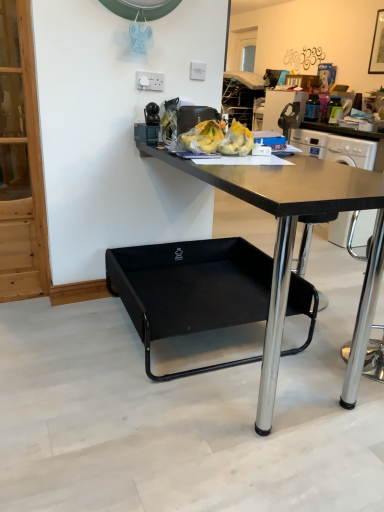
Question: Is black glass picture frame at upper right taller than black matte desk at center?

Choices:
 (A) no
 (B) yes

Answer: (A)

Question: Considering the relative positions of black glass picture frame at upper right and black matte desk at center in the image provided, is black glass picture frame at upper right to the right of black matte desk at center from the viewer's perspective?

Choices:
 (A) yes
 (B) no

Answer: (A)

Question: Does black glass picture frame at upper right have a lesser height compared to black matte desk at center?

Choices:
 (A) no
 (B) yes

Answer: (B)

Question: Is black glass picture frame at upper right turned away from black matte desk at center?

Choices:
 (A) no
 (B) yes

Answer: (A)

Question: Considering the relative sizes of black glass picture frame at upper right and black matte desk at center in the image provided, is black glass picture frame at upper right thinner than black matte desk at center?

Choices:
 (A) no
 (B) yes

Answer: (B)

Question: In terms of size, does black glass picture frame at upper right appear bigger or smaller than white plastic power outlet at upper center, the 2th power outlet when ordered from back to front?

Choices:
 (A) big
 (B) small

Answer: (A)

Question: From the image's perspective, is black glass picture frame at upper right above or below white plastic power outlet at upper center, the 2th power outlet when ordered from back to front?

Choices:
 (A) below
 (B) above

Answer: (B)

Question: Choose the correct answer: Is black glass picture frame at upper right inside white plastic power outlet at upper center, which is counted as the 1th power outlet, starting from the front, or outside it?

Choices:
 (A) outside
 (B) inside

Answer: (A)

Question: In the image, is black glass picture frame at upper right on the left side or the right side of white plastic power outlet at upper center, the 1th power outlet in the left-to-right sequence?

Choices:
 (A) left
 (B) right

Answer: (B)

Question: From a real-world perspective, is black glass picture frame at upper right positioned above or below metallic black coffee machine at upper right?

Choices:
 (A) below
 (B) above

Answer: (B)

Question: From their relative heights in the image, would you say black glass picture frame at upper right is taller or shorter than metallic black coffee machine at upper right?

Choices:
 (A) short
 (B) tall

Answer: (B)

Question: Relative to metallic black coffee machine at upper right, is black glass picture frame at upper right in front or behind?

Choices:
 (A) front
 (B) behind

Answer: (A)

Question: In terms of width, does black glass picture frame at upper right look wider or thinner when compared to metallic black coffee machine at upper right?

Choices:
 (A) thin
 (B) wide

Answer: (A)

Question: Would you say white plastic power outlet at upper center, the 2th power outlet in the front-to-back sequence, is to the left or to the right of white plastic power outlet at upper center, the 1th power outlet in the left-to-right sequence, in the picture?

Choices:
 (A) right
 (B) left

Answer: (A)

Question: Considering the positions of white plastic power outlet at upper center, which ranks as the 1th power outlet in right-to-left order, and white plastic power outlet at upper center, the 1th power outlet in the left-to-right sequence, in the image, is white plastic power outlet at upper center, which ranks as the 1th power outlet in right-to-left order, bigger or smaller than white plastic power outlet at upper center, the 1th power outlet in the left-to-right sequence,?

Choices:
 (A) big
 (B) small

Answer: (A)